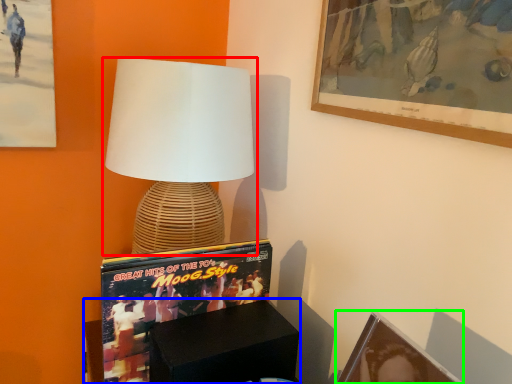
Question: Which object is the farthest from lamp (highlighted by a red box)? Choose among these: furniture (highlighted by a blue box) or picture frame (highlighted by a green box).

Choices:
 (A) furniture
 (B) picture frame

Answer: (B)